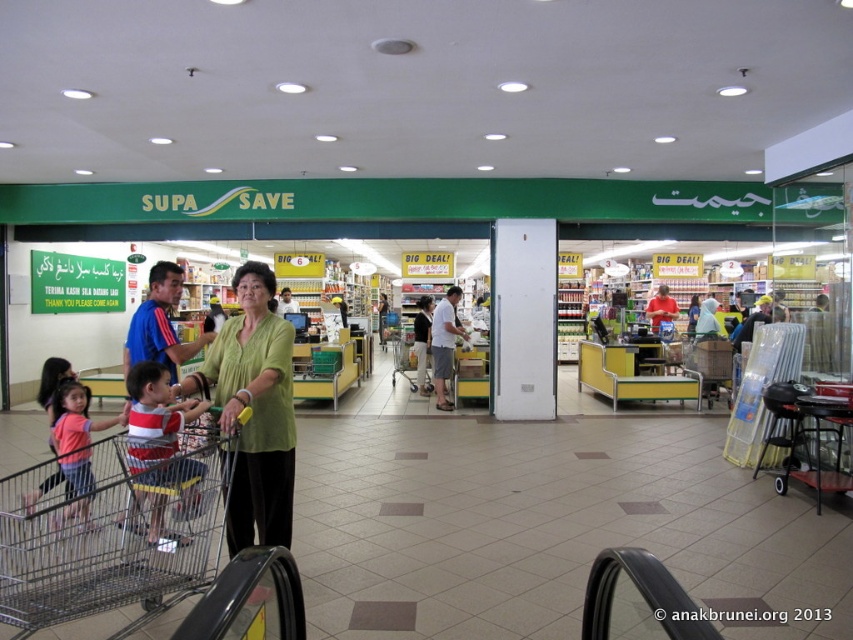
Between pink matte shirt at lower left and white cotton shirt at center, which one has more height?

With more height is white cotton shirt at center.

Is pink matte shirt at lower left thinner than white cotton shirt at center?

No.

Is point (62, 394) closer to camera compared to point (444, 362)?

Yes, it is in front of point (444, 362).

In order to click on pink matte shirt at lower left in this screenshot , I will do `click(76, 448)`.

Is metallic silver shopping cart at center shorter than striped cotton shirt at lower left?

No.

Between metallic silver shopping cart at center and striped cotton shirt at lower left, which one is positioned lower?

metallic silver shopping cart at center is lower down.

Between point (49, 554) and point (136, 416), which one is positioned in front?

Point (49, 554) is in front.

This screenshot has height=640, width=853. Identify the location of metallic silver shopping cart at center. (113, 538).

Is metallic silver shopping cart at center taller than white cotton shirt at center?

Incorrect, metallic silver shopping cart at center's height is not larger of white cotton shirt at center's.

Is metallic silver shopping cart at center shorter than white cotton shirt at center?

Yes, metallic silver shopping cart at center is shorter than white cotton shirt at center.

Which is in front, point (148, 508) or point (440, 349)?

Positioned in front is point (148, 508).

You are a GUI agent. You are given a task and a screenshot of the screen. Output one action in this format:
    pyautogui.click(x=<x>, y=<y>)
    Task: Click on the metallic silver shopping cart at center
    Image resolution: width=853 pixels, height=640 pixels.
    Given the screenshot: What is the action you would take?
    pyautogui.click(x=113, y=538)